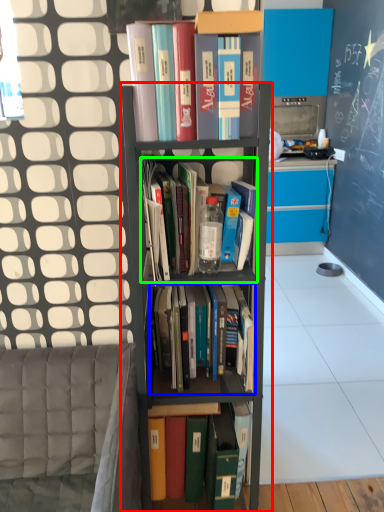
Question: Based on their relative distances, which object is farther from shelf (highlighted by a red box)? Choose from book (highlighted by a blue box) and book (highlighted by a green box).

Choices:
 (A) book
 (B) book

Answer: (B)